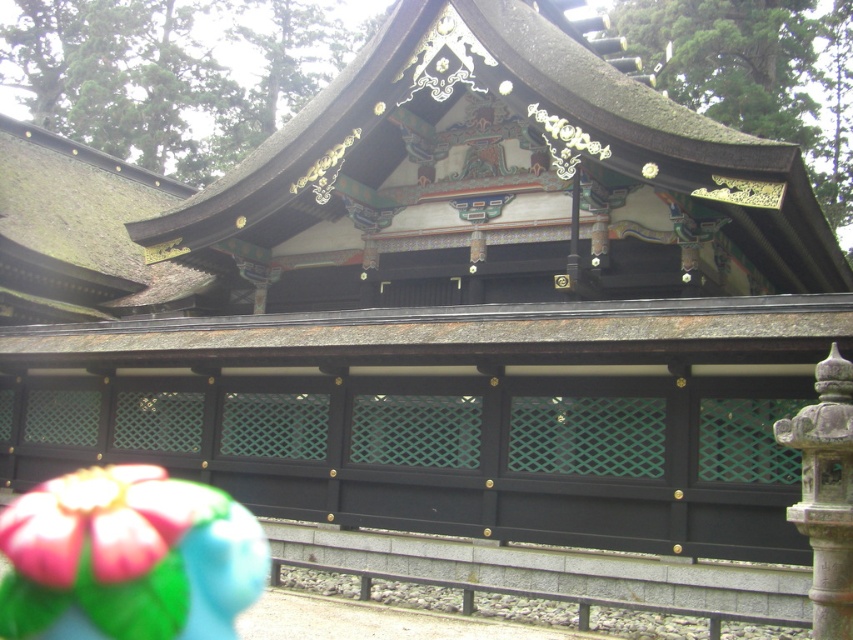
Measure the distance between point (473, 28) and camera.

Point (473, 28) is 20.67 meters from camera.

How far apart are shiny dark brown roof at center and dark gray stone pillar at right?

48.31 feet

At what (x,y) coordinates should I click in order to perform the action: click on shiny dark brown roof at center. Please return your answer as a coordinate pair (x, y). This screenshot has height=640, width=853. Looking at the image, I should click on (498, 180).

Can you confirm if shiny dark brown roof at center is bigger than green mossy thatch at upper left?

Correct, shiny dark brown roof at center is larger in size than green mossy thatch at upper left.

Does shiny dark brown roof at center appear on the right side of green mossy thatch at upper left?

Yes, shiny dark brown roof at center is to the right of green mossy thatch at upper left.

Which is behind, point (310, 188) or point (54, 253)?

Point (54, 253)

What are the coordinates of `shiny dark brown roof at center` in the screenshot? It's located at (498, 180).

Does green mossy thatch at upper left have a lesser height compared to dark gray stone pillar at right?

No.

Identify the location of green mossy thatch at upper left. The height and width of the screenshot is (640, 853). (80, 234).